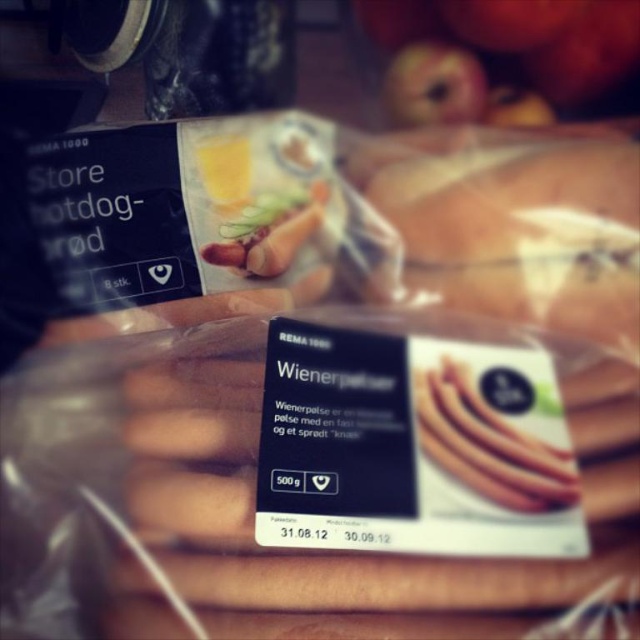
Question: Which of the following is the closest to the observer?

Choices:
 (A) (468, 122)
 (B) (584, 200)

Answer: (B)

Question: Is translucent plastic bag at center in front of smooth red apple at upper center?

Choices:
 (A) no
 (B) yes

Answer: (B)

Question: Observing the image, what is the correct spatial positioning of translucent plastic bag at center in reference to smooth red apple at upper center?

Choices:
 (A) below
 (B) above

Answer: (A)

Question: Which point is farther to the camera?

Choices:
 (A) (454, 296)
 (B) (429, 77)

Answer: (B)

Question: Is translucent plastic bag at center wider than smooth red apple at upper center?

Choices:
 (A) yes
 (B) no

Answer: (A)